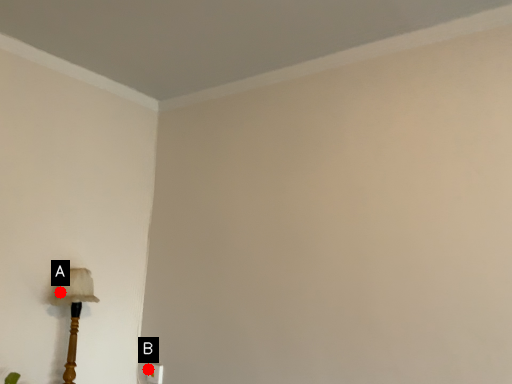
Question: Two points are circled on the image, labeled by A and B beside each circle. Which point is closer to the camera?

Choices:
 (A) A is closer
 (B) B is closer

Answer: (A)